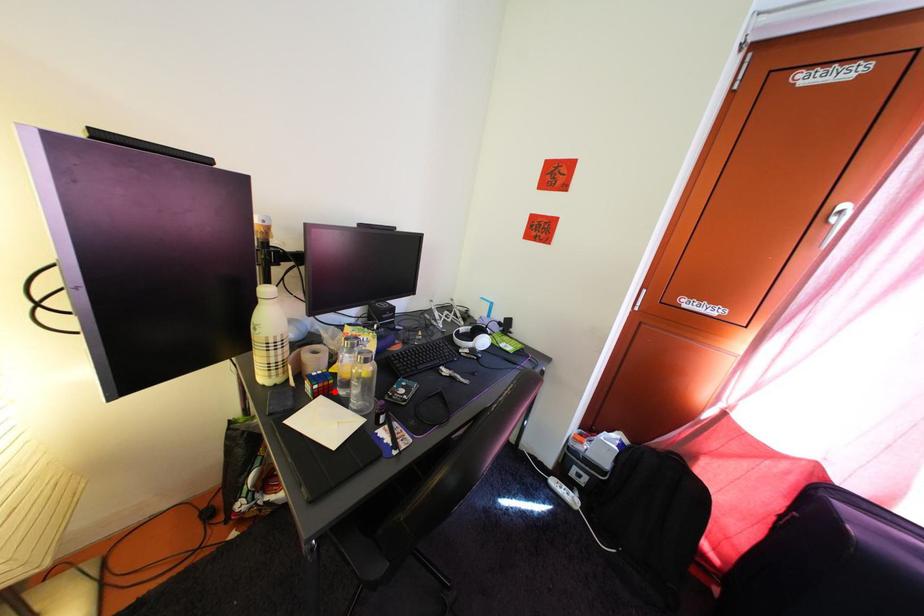
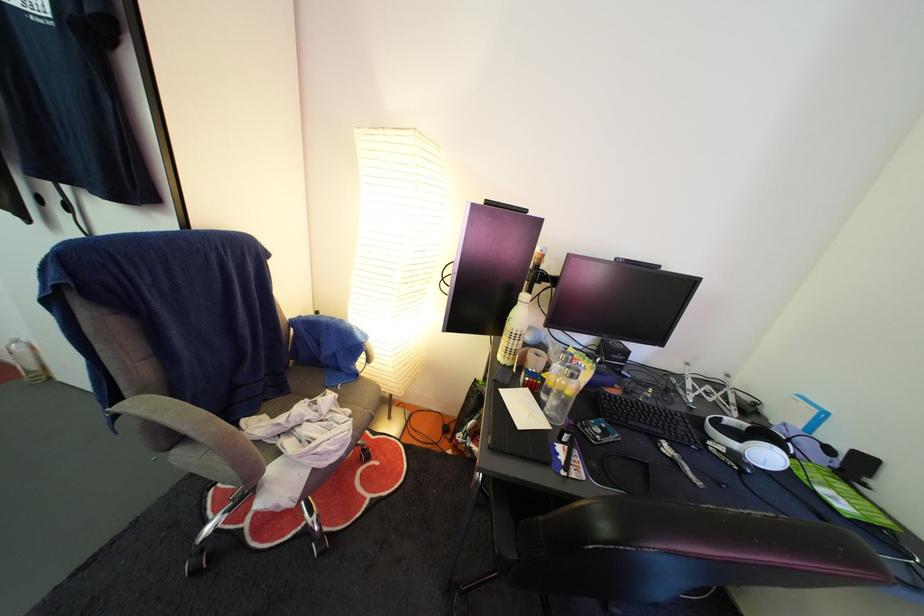
The point at the highlighted location is marked in the first image. Where is the corresponding point in the second image?

(543, 390)